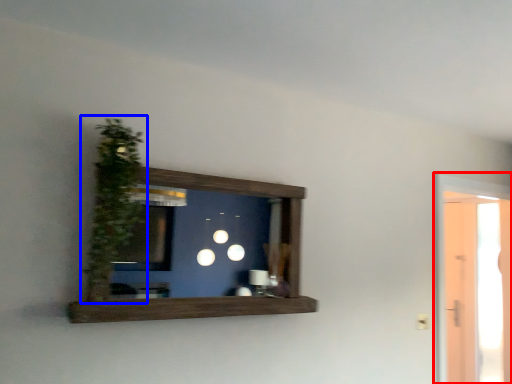
Question: Which point is further to the camera, glass door (highlighted by a red box) or plant (highlighted by a blue box)?

Choices:
 (A) glass door
 (B) plant

Answer: (A)